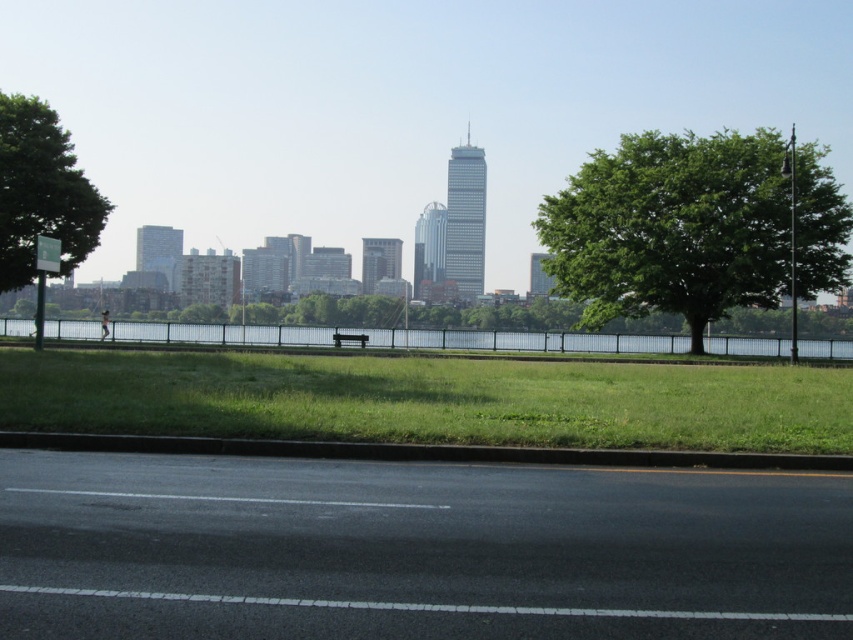
Which is more to the left, clear water at center or wooden park bench at center?

wooden park bench at center

Is point (727, 342) farther from camera compared to point (354, 333)?

No, it is not.

The height and width of the screenshot is (640, 853). I want to click on clear water at center, so click(396, 339).

Based on the photo, which is below, green grass at center or clear water at center?

Positioned lower is green grass at center.

Between green grass at center and clear water at center, which one has less height?

With less height is green grass at center.

Is point (695, 426) farther from viewer compared to point (497, 340)?

That is False.

Where is `green grass at center`? The width and height of the screenshot is (853, 640). green grass at center is located at coordinates (428, 400).

Describe the element at coordinates (694, 227) in the screenshot. I see `green leafy tree at right` at that location.

Is green leafy tree at right below clear water at center?

No, green leafy tree at right is not below clear water at center.

Which is behind, point (752, 195) or point (750, 355)?

The point (750, 355) is behind.

Find the location of a particular element. green leafy tree at right is located at coordinates (694, 227).